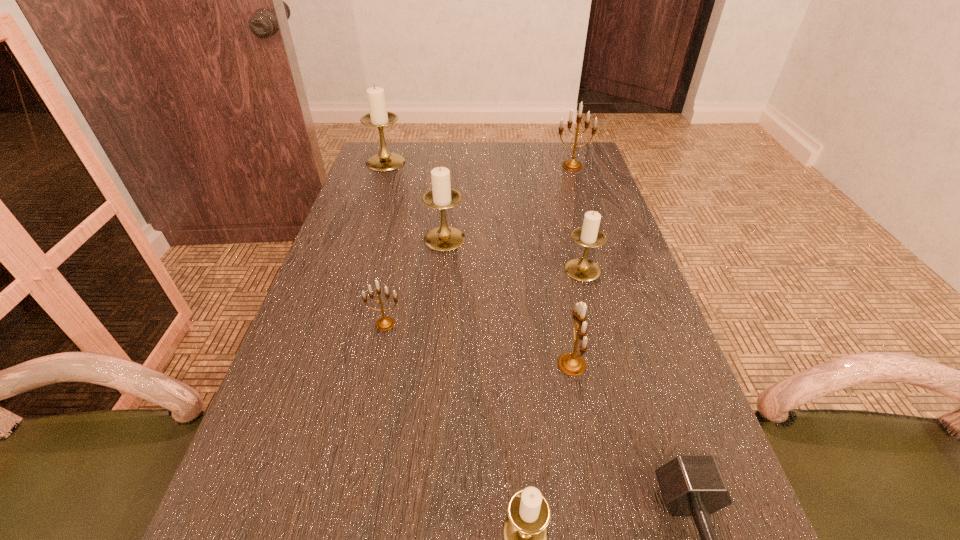
Locate an element on the screen. This screenshot has height=540, width=960. object that stands as the seventh closest to the shortest object is located at coordinates (379, 117).

Locate which object ranks sixth in proximity to the third object from left to right. Please provide its 2D coordinates. Your answer should be formatted as a tuple, i.e. [(x, y)], where the tuple contains the x and y coordinates of a point satisfying the conditions above.

[(525, 532)]

The image size is (960, 540). I want to click on the closest candle holder to the rightmost gold candelabrum, so click(x=444, y=238).

Choose which candle holder is the third nearest neighbor to the second white candle holder from left to right. Please provide its 2D coordinates. Your answer should be formatted as a tuple, i.e. [(x, y)], where the tuple contains the x and y coordinates of a point satisfying the conditions above.

[(379, 117)]

You are a GUI agent. You are given a task and a screenshot of the screen. Output one action in this format:
    pyautogui.click(x=<x>, y=<y>)
    Task: Click on the white candle holder that can be found as the second closest to the shortest object
    
    Given the screenshot: What is the action you would take?
    pyautogui.click(x=582, y=269)

Find the location of a particular element. white candle holder that is the third closest to the third nearest white candle holder is located at coordinates (525, 532).

Choose which gold candelabrum is the nearest neighbor to the biggest gold candelabrum. Please provide its 2D coordinates. Your answer should be formatted as a tuple, i.e. [(x, y)], where the tuple contains the x and y coordinates of a point satisfying the conditions above.

[(572, 364)]

At what (x,y) coordinates should I click in order to perform the action: click on gold candelabrum that stands as the closest to the farthest gold candelabrum. Please return your answer as a coordinate pair (x, y). Looking at the image, I should click on (572, 364).